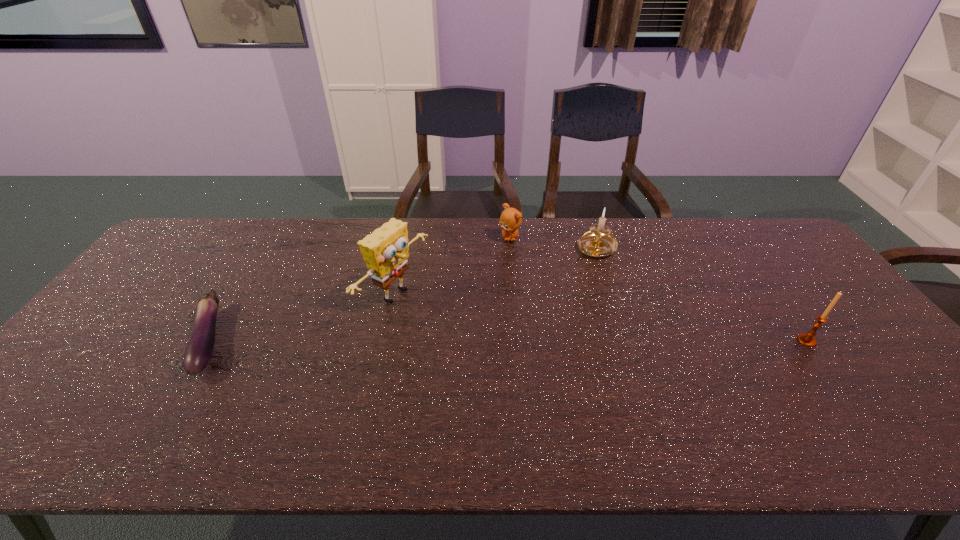
The height and width of the screenshot is (540, 960). In order to click on empty location between the nearer candle holder and the teddy bear in this screenshot , I will do `click(659, 289)`.

What are the coordinates of `object that is the third closest to the shortest object` in the screenshot? It's located at (598, 242).

Identify which object is the closest to the right candle holder. Please provide its 2D coordinates. Your answer should be formatted as a tuple, i.e. [(x, y)], where the tuple contains the x and y coordinates of a point satisfying the conditions above.

[(598, 242)]

Where is `free location that satisfies the following two spatial constraints: 1. on the back side of the left candle holder; 2. on the right side of the sponge`? free location that satisfies the following two spatial constraints: 1. on the back side of the left candle holder; 2. on the right side of the sponge is located at coordinates (405, 248).

Identify the location of vacant region that satisfies the following two spatial constraints: 1. on the front side of the third tallest object; 2. on the right side of the nearer candle holder. (628, 341).